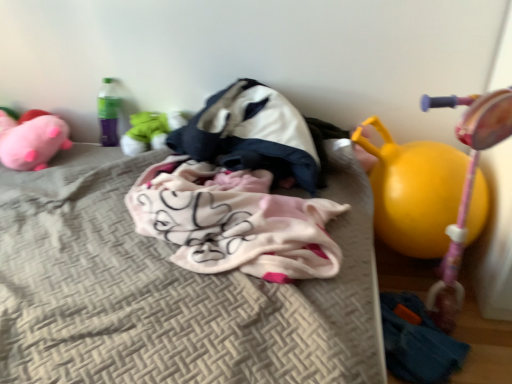
Question: From a real-world perspective, is soft plush toy at center, the 2th toy in the right-to-left sequence, on top of fluffy pink blanket at center?

Choices:
 (A) yes
 (B) no

Answer: (B)

Question: Can you confirm if soft plush toy at center, positioned as the second toy in left-to-right order, is thinner than fluffy pink blanket at center?

Choices:
 (A) no
 (B) yes

Answer: (B)

Question: From a real-world perspective, is soft plush toy at center, the 2th toy in the right-to-left sequence, located beneath fluffy pink blanket at center?

Choices:
 (A) yes
 (B) no

Answer: (A)

Question: Is soft plush toy at center, the 2th toy in the right-to-left sequence, wider than fluffy pink blanket at center?

Choices:
 (A) no
 (B) yes

Answer: (A)

Question: Is soft plush toy at center, the 2th toy in the right-to-left sequence, outside fluffy pink blanket at center?

Choices:
 (A) no
 (B) yes

Answer: (B)

Question: Considering the positions of beige textured mattress at center and yellow rubber ball at right in the image, is beige textured mattress at center wider or thinner than yellow rubber ball at right?

Choices:
 (A) wide
 (B) thin

Answer: (A)

Question: In terms of height, does beige textured mattress at center look taller or shorter compared to yellow rubber ball at right?

Choices:
 (A) short
 (B) tall

Answer: (A)

Question: Is beige textured mattress at center in front of or behind yellow rubber ball at right in the image?

Choices:
 (A) front
 (B) behind

Answer: (A)

Question: Based on their positions, is beige textured mattress at center located to the left or right of yellow rubber ball at right?

Choices:
 (A) left
 (B) right

Answer: (A)

Question: Is yellow rubber ball at right, placed as the 1th toy when sorted from right to left, inside the boundaries of pink plush toy at left, placed as the 3th toy when sorted from right to left, or outside?

Choices:
 (A) outside
 (B) inside

Answer: (A)

Question: Considering the positions of yellow rubber ball at right, the 3th toy when ordered from left to right, and pink plush toy at left, the 1th toy in the left-to-right sequence, in the image, is yellow rubber ball at right, the 3th toy when ordered from left to right, taller or shorter than pink plush toy at left, the 1th toy in the left-to-right sequence,?

Choices:
 (A) tall
 (B) short

Answer: (A)

Question: Is yellow rubber ball at right, the 3th toy when ordered from left to right, in front of or behind pink plush toy at left, placed as the 3th toy when sorted from right to left, in the image?

Choices:
 (A) behind
 (B) front

Answer: (B)

Question: From a real-world perspective, relative to pink plush toy at left, placed as the 3th toy when sorted from right to left, is yellow rubber ball at right, the 3th toy when ordered from left to right, vertically above or below?

Choices:
 (A) above
 (B) below

Answer: (B)

Question: In terms of height, does yellow rubber ball at right look taller or shorter compared to white and navy blue fabric sleeping bag at center?

Choices:
 (A) short
 (B) tall

Answer: (B)

Question: Choose the correct answer: Is yellow rubber ball at right inside white and navy blue fabric sleeping bag at center or outside it?

Choices:
 (A) outside
 (B) inside

Answer: (A)